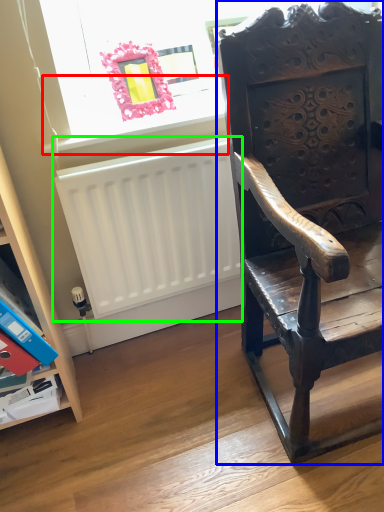
Question: Considering the real-world distances, which object is closest to window sill (highlighted by a red box)? chair (highlighted by a blue box) or radiator (highlighted by a green box).

Choices:
 (A) chair
 (B) radiator

Answer: (B)